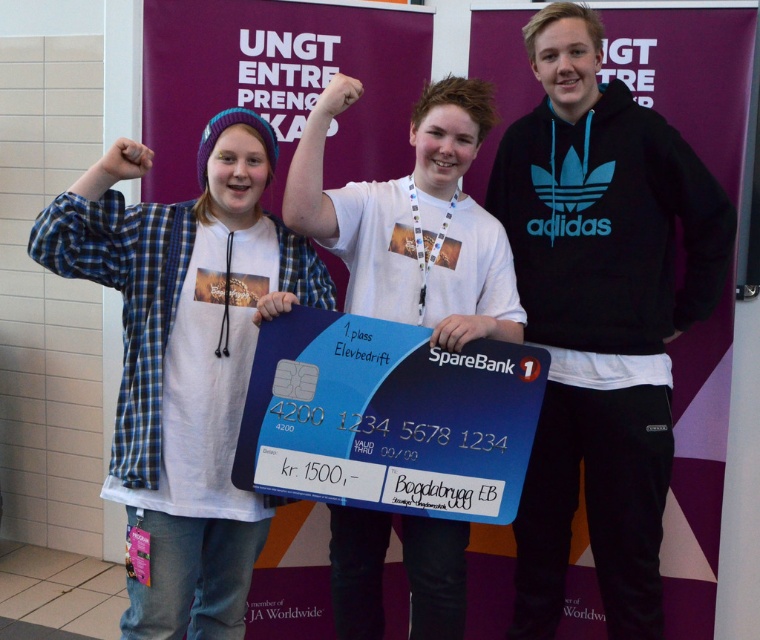
Consider the image. Who is more forward, (543, 340) or (233, 532)?

Point (233, 532) is in front.

Which is below, black fleece sweatshirt at right or matte blue card at center?

matte blue card at center

At what (x,y) coordinates should I click in order to perform the action: click on black fleece sweatshirt at right. Please return your answer as a coordinate pair (x, y). Looking at the image, I should click on pos(600,316).

Between point (138, 160) and point (382, 529), which one is positioned behind?

Point (382, 529)

Does point (171, 224) lie behind point (475, 339)?

Yes, it is behind point (475, 339).

You are a GUI agent. You are given a task and a screenshot of the screen. Output one action in this format:
    pyautogui.click(x=<x>, y=<y>)
    Task: Click on the matte blue card at center
    The width and height of the screenshot is (760, 640).
    Given the screenshot: What is the action you would take?
    (x=185, y=358)

This screenshot has height=640, width=760. Find the location of `matte blue card at center`. matte blue card at center is located at coordinates pyautogui.click(x=185, y=358).

Is point (638, 396) positioned after point (499, 310)?

Yes, point (638, 396) is behind point (499, 310).

The width and height of the screenshot is (760, 640). I want to click on black fleece sweatshirt at right, so click(x=600, y=316).

You are a GUI agent. You are given a task and a screenshot of the screen. Output one action in this format:
    pyautogui.click(x=<x>, y=<y>)
    Task: Click on the black fleece sweatshirt at right
    
    Given the screenshot: What is the action you would take?
    pyautogui.click(x=600, y=316)